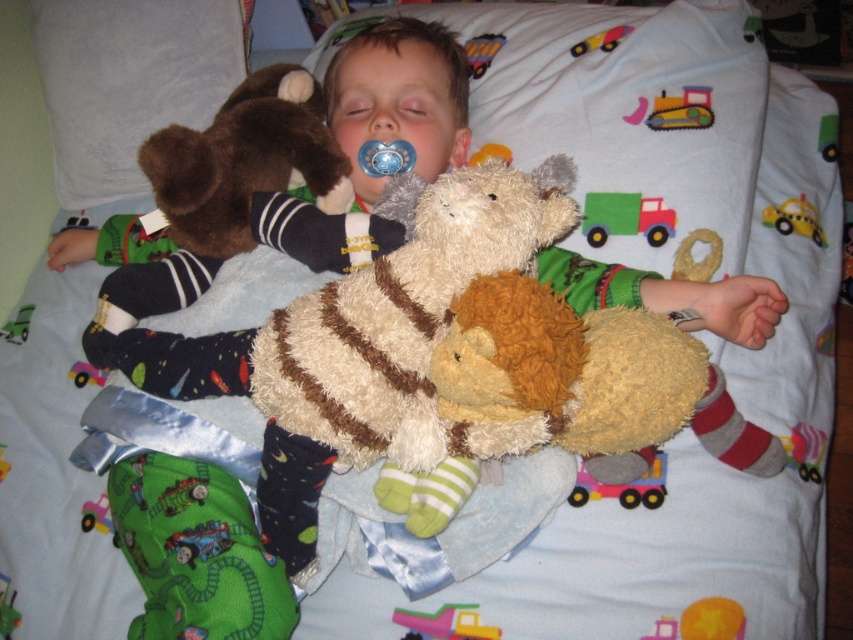
Question: Is green fabric train at lower left thinner than rubber pink toy car at lower left?

Choices:
 (A) no
 (B) yes

Answer: (A)

Question: Which point is closer to the camera?

Choices:
 (A) (622, 499)
 (B) (595, 198)
 (C) (142, 468)

Answer: (C)

Question: Considering the relative positions of green fabric train at lower left and plush yellow train at center in the image provided, where is green fabric train at lower left located with respect to plush yellow train at center?

Choices:
 (A) left
 (B) right

Answer: (A)

Question: Estimate the real-world distances between objects in this image. Which object is closer to the yellow rubber duck at upper right?

Choices:
 (A) pink felt truck at center
 (B) rubber pink toy car at lower left
 (C) plush yellow train at center

Answer: (A)

Question: From the image, what is the correct spatial relationship of green fabric train at lower left in relation to blue plastic pacifier at center?

Choices:
 (A) below
 (B) above

Answer: (A)

Question: Which point appears closest to the camera in this image?

Choices:
 (A) (776, 220)
 (B) (416, 616)
 (C) (97, 376)

Answer: (B)